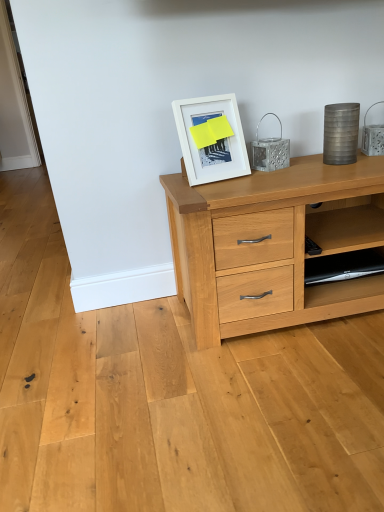
Question: Is white matte picture frame at upper center further to camera compared to black plastic shelf at lower right?

Choices:
 (A) no
 (B) yes

Answer: (A)

Question: From the image's perspective, is white matte picture frame at upper center over black plastic shelf at lower right?

Choices:
 (A) yes
 (B) no

Answer: (A)

Question: From a real-world perspective, is white matte picture frame at upper center on top of black plastic shelf at lower right?

Choices:
 (A) no
 (B) yes

Answer: (B)

Question: Can you confirm if white matte picture frame at upper center is taller than black plastic shelf at lower right?

Choices:
 (A) yes
 (B) no

Answer: (A)

Question: Does white matte picture frame at upper center contain black plastic shelf at lower right?

Choices:
 (A) no
 (B) yes

Answer: (A)

Question: From the image's perspective, is white matte picture frame at upper center below black plastic shelf at lower right?

Choices:
 (A) no
 (B) yes

Answer: (A)

Question: From a real-world perspective, is black plastic shelf at lower right over white matte picture frame at upper center?

Choices:
 (A) yes
 (B) no

Answer: (B)

Question: Can we say black plastic shelf at lower right lies outside white matte picture frame at upper center?

Choices:
 (A) yes
 (B) no

Answer: (A)

Question: Is black plastic shelf at lower right facing away from white matte picture frame at upper center?

Choices:
 (A) no
 (B) yes

Answer: (A)

Question: Is black plastic shelf at lower right facing towards white matte picture frame at upper center?

Choices:
 (A) yes
 (B) no

Answer: (B)

Question: Is black plastic shelf at lower right behind white matte picture frame at upper center?

Choices:
 (A) no
 (B) yes

Answer: (B)

Question: Considering the relative sizes of black plastic shelf at lower right and white matte picture frame at upper center in the image provided, is black plastic shelf at lower right shorter than white matte picture frame at upper center?

Choices:
 (A) no
 (B) yes

Answer: (B)

Question: From the image's perspective, is white matte picture frame at upper center located above or below black plastic shelf at lower right?

Choices:
 (A) above
 (B) below

Answer: (A)